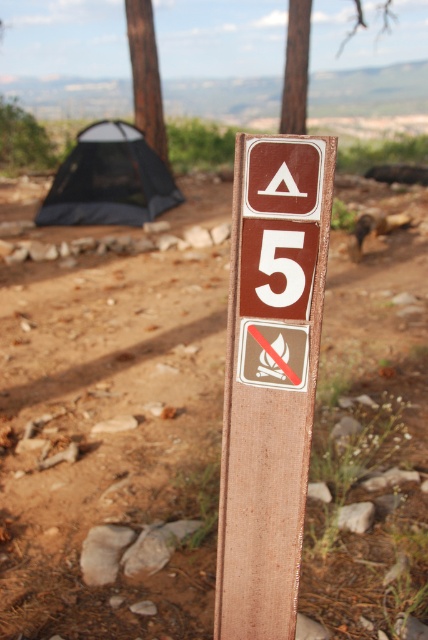
Measure the distance from black mesh tent at left to brown wood pole at upper center.

The distance of black mesh tent at left from brown wood pole at upper center is 7.91 meters.

Is point (127, 193) positioned after point (294, 104)?

No.

Is point (104, 177) less distant than point (293, 77)?

Yes, it is.

Locate an element on the screen. The width and height of the screenshot is (428, 640). black mesh tent at left is located at coordinates (109, 179).

Can you confirm if brown wooden sign at center is shorter than black mesh tent at left?

Correct, brown wooden sign at center is not as tall as black mesh tent at left.

Who is shorter, brown wooden sign at center or black mesh tent at left?

brown wooden sign at center

Is point (258, 456) positioned after point (101, 164)?

No, (258, 456) is closer to viewer.

Where is `brown wooden sign at center`? The width and height of the screenshot is (428, 640). brown wooden sign at center is located at coordinates (270, 378).

Does brown dirt track at center come in front of black mesh tent at left?

Yes, brown dirt track at center is in front of black mesh tent at left.

Can you confirm if brown dirt track at center is positioned to the right of black mesh tent at left?

Yes, brown dirt track at center is to the right of black mesh tent at left.

Between point (157, 445) and point (113, 168), which one is positioned in front?

Point (157, 445) is in front.

At what (x,y) coordinates should I click in order to perform the action: click on brown dirt track at center. Please return your answer as a coordinate pair (x, y). The height and width of the screenshot is (640, 428). Looking at the image, I should click on (110, 440).